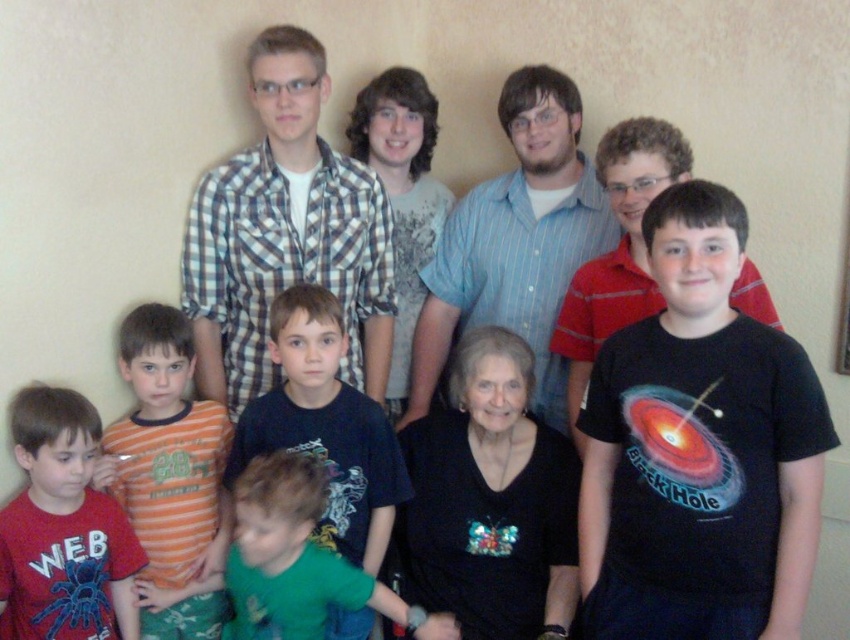
You are organizing a charity event and need to determine which of the two shirts, the orange cotton shirt at lower left or the green fabric shirt at lower center, can better accommodate a larger logo patch. Based on their sizes, which one would you choose?

The orange cotton shirt at lower left is larger in size than the green fabric shirt at lower center, so it can better accommodate a larger logo patch.

You are standing in the room where the family photo was taken. There is a checkered fabric shirt at upper center located at point (285, 234). If you were to walk straight towards the beige wall behind the group, would you pass through this point before reaching the wall?

Yes, because the checkered fabric shirt at upper center is located at point (285, 234), which is in front of the beige wall, so walking towards the wall would require passing through this point before reaching the wall.